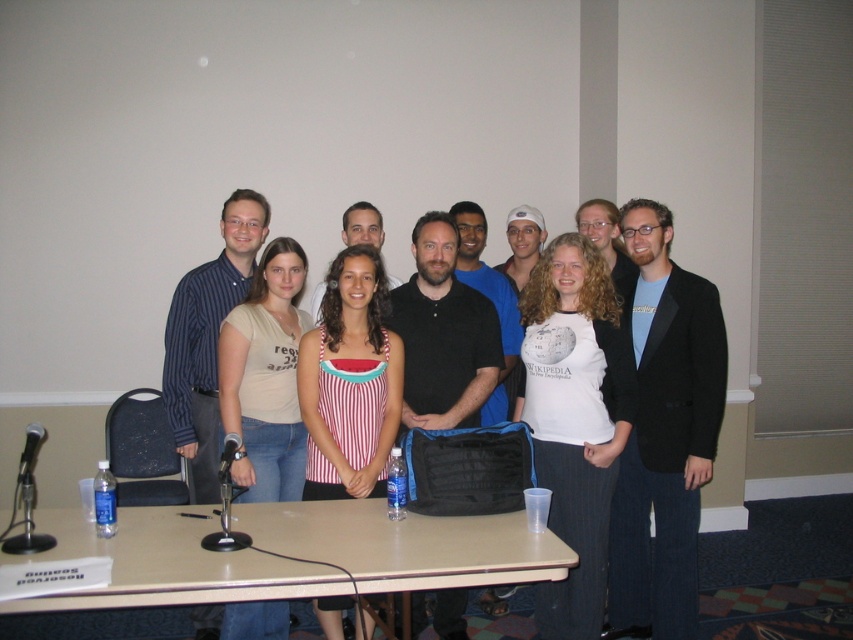
Can you confirm if beige laminate table at lower center is positioned below white cotton t-shirt at center?

Indeed, beige laminate table at lower center is positioned under white cotton t-shirt at center.

Which is behind, point (450, 568) or point (563, 512)?

The point (563, 512) is more distant.

Which is in front, point (380, 582) or point (550, 310)?

Point (380, 582) is more forward.

Where is `beige laminate table at lower center`? beige laminate table at lower center is located at coordinates (407, 545).

Can you confirm if black matte blazer at right is thinner than white cotton t-shirt at center?

Indeed, black matte blazer at right has a lesser width compared to white cotton t-shirt at center.

Can you confirm if black matte blazer at right is positioned to the left of white cotton t-shirt at center?

In fact, black matte blazer at right is to the right of white cotton t-shirt at center.

The height and width of the screenshot is (640, 853). What do you see at coordinates (664, 432) in the screenshot?
I see `black matte blazer at right` at bounding box center [664, 432].

Image resolution: width=853 pixels, height=640 pixels. In order to click on black matte blazer at right in this screenshot , I will do `click(664, 432)`.

Is white cotton shirt at center smaller than black matte blazer at right?

No.

Locate an element on the screen. Image resolution: width=853 pixels, height=640 pixels. white cotton shirt at center is located at coordinates (659, 417).